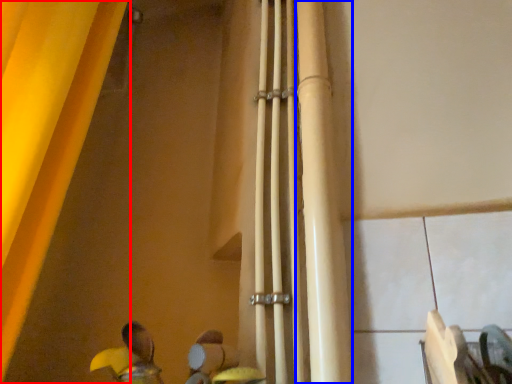
Question: Which object is further to the camera taking this photo, curtain (highlighted by a red box) or beam (highlighted by a blue box)?

Choices:
 (A) curtain
 (B) beam

Answer: (B)